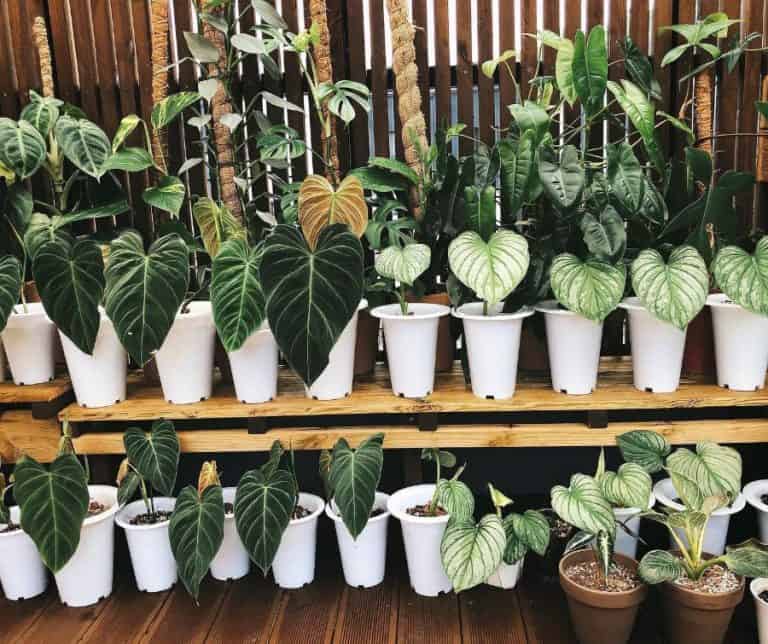
You are a GUI agent. You are given a task and a screenshot of the screen. Output one action in this format:
    pyautogui.click(x=<x>, y=<y>)
    Task: Click on the pot
    
    Given the screenshot: What is the action you would take?
    pyautogui.click(x=263, y=363)